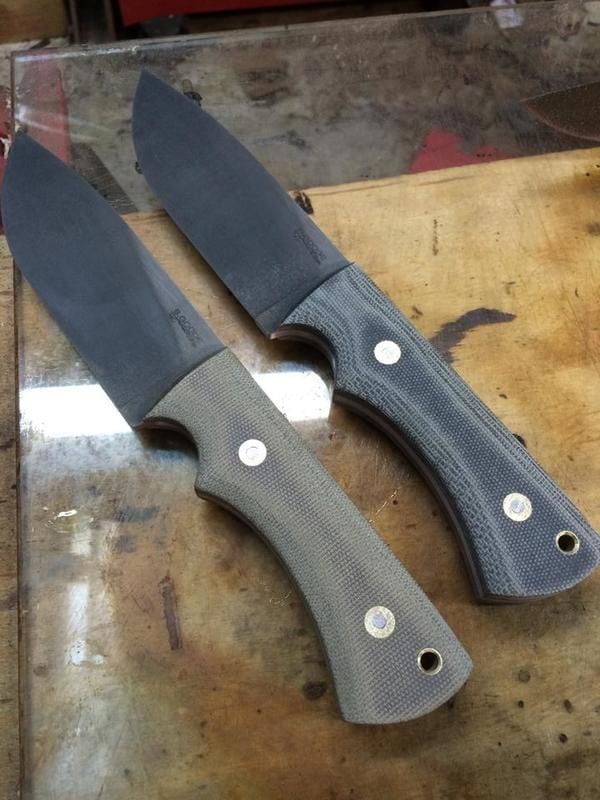
Where is `cutting board`? This screenshot has height=800, width=600. cutting board is located at coordinates (171, 642).